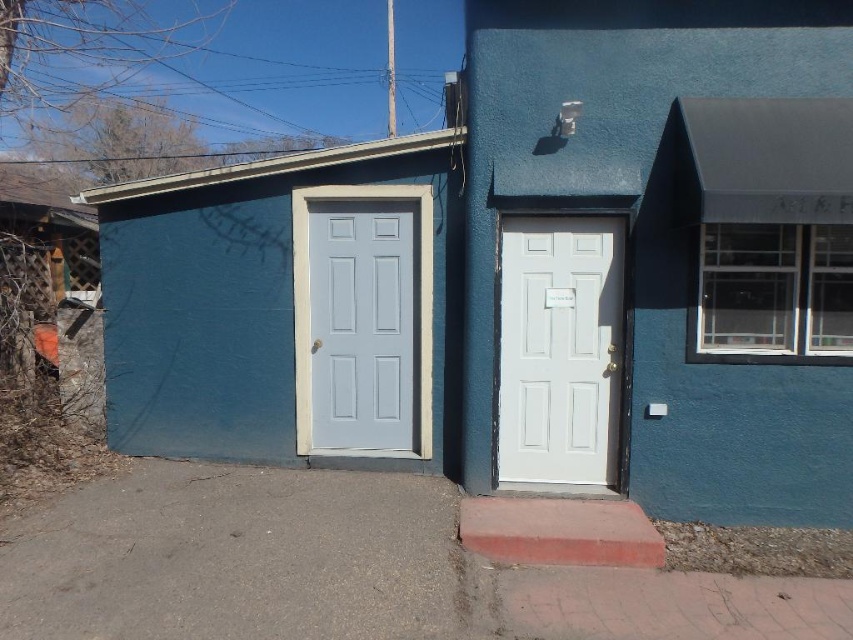
Question: Is white matte door at center above light blue painted wood door at left?

Choices:
 (A) yes
 (B) no

Answer: (B)

Question: Can you confirm if white matte door at center is bigger than light blue painted wood door at left?

Choices:
 (A) no
 (B) yes

Answer: (B)

Question: Which of the following is the closest to the observer?

Choices:
 (A) (553, 435)
 (B) (372, 214)

Answer: (A)

Question: Which point is farther to the camera?

Choices:
 (A) (543, 385)
 (B) (379, 433)

Answer: (B)

Question: Is the position of white matte door at center more distant than that of light blue painted wood door at left?

Choices:
 (A) no
 (B) yes

Answer: (A)

Question: Which object appears closest to the camera in this image?

Choices:
 (A) light blue painted wood door at left
 (B) white matte door at center

Answer: (B)